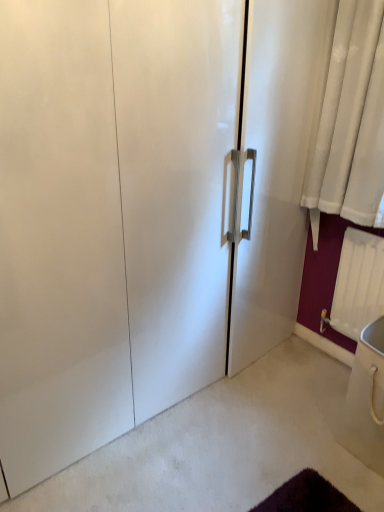
Question: Is white plastic radiator at lower right not near white glossy sink at lower right?

Choices:
 (A) no
 (B) yes

Answer: (A)

Question: Is the position of white plastic radiator at lower right more distant than that of white glossy sink at lower right?

Choices:
 (A) no
 (B) yes

Answer: (B)

Question: Is white plastic radiator at lower right at the right side of white glossy sink at lower right?

Choices:
 (A) yes
 (B) no

Answer: (B)

Question: Could you tell me if white plastic radiator at lower right is facing white glossy sink at lower right?

Choices:
 (A) no
 (B) yes

Answer: (A)

Question: Is the position of white plastic radiator at lower right less distant than that of white glossy sink at lower right?

Choices:
 (A) yes
 (B) no

Answer: (B)

Question: Is white plastic radiator at lower right outside of white glossy sink at lower right?

Choices:
 (A) yes
 (B) no

Answer: (A)

Question: Are white glossy sink at lower right and white plastic radiator at lower right making contact?

Choices:
 (A) no
 (B) yes

Answer: (A)

Question: Is the depth of white glossy sink at lower right less than that of white plastic radiator at lower right?

Choices:
 (A) yes
 (B) no

Answer: (A)

Question: From a real-world perspective, is white glossy sink at lower right on top of white plastic radiator at lower right?

Choices:
 (A) yes
 (B) no

Answer: (B)

Question: Is white glossy sink at lower right oriented away from white plastic radiator at lower right?

Choices:
 (A) yes
 (B) no

Answer: (B)

Question: From a real-world perspective, is white glossy sink at lower right located beneath white plastic radiator at lower right?

Choices:
 (A) no
 (B) yes

Answer: (B)

Question: Can you confirm if white glossy sink at lower right is taller than white plastic radiator at lower right?

Choices:
 (A) yes
 (B) no

Answer: (B)

Question: Choose the correct answer: Is white plastic radiator at lower right inside white glossy sink at lower right or outside it?

Choices:
 (A) outside
 (B) inside

Answer: (A)